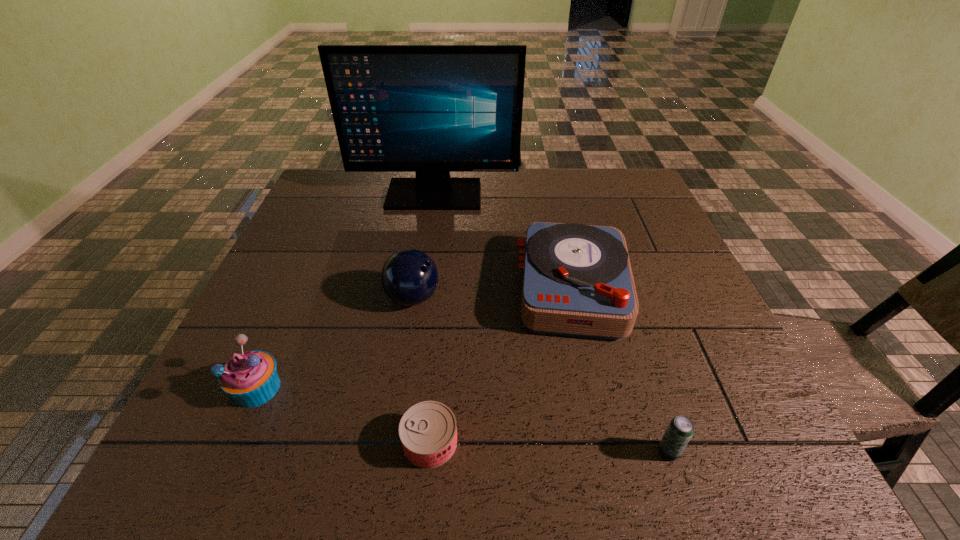
Locate an element on the screen. Image resolution: width=960 pixels, height=540 pixels. free point between the can and the muffin is located at coordinates (344, 415).

You are a GUI agent. You are given a task and a screenshot of the screen. Output one action in this format:
    pyautogui.click(x=<x>, y=<y>)
    Task: Click on the free space between the bowling ball and the shortest object
    This screenshot has width=960, height=540.
    Given the screenshot: What is the action you would take?
    pyautogui.click(x=421, y=370)

Identify the location of empty location between the shortest object and the tallest object. (432, 319).

Select which object appears as the closest to the can. Please provide its 2D coordinates. Your answer should be formatted as a tuple, i.e. [(x, y)], where the tuple contains the x and y coordinates of a point satisfying the conditions above.

[(577, 279)]

Identify the location of the closest object to the muffin. (409, 277).

At what (x,y) coordinates should I click in order to perform the action: click on free spot that satisfies the following two spatial constraints: 1. on the front side of the record player; 2. on the left side of the second shortest object. Please return your answer as a coordinate pair (x, y). Looking at the image, I should click on 611,451.

Locate an element on the screen. vacant space that satisfies the following two spatial constraints: 1. on the surface of the fifth tallest object near the finger holes; 2. on the left side of the bowling ball is located at coordinates (388, 451).